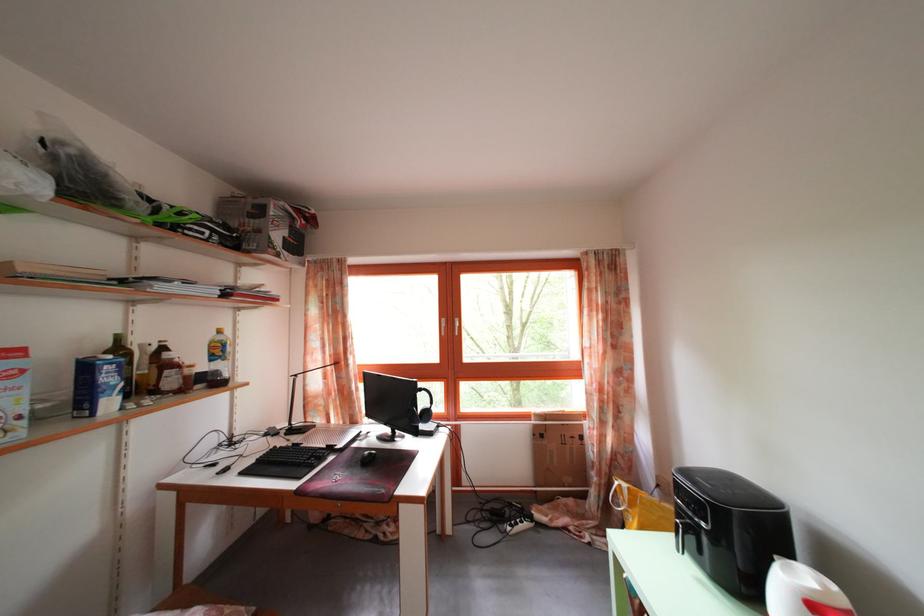
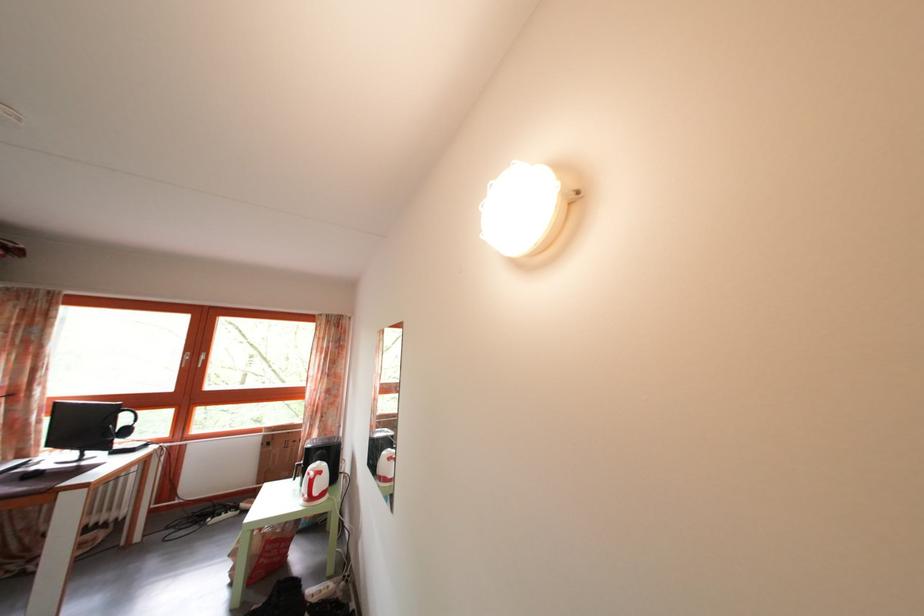
Find the pixel in the second image that matches point (517, 512) in the first image.

(233, 514)